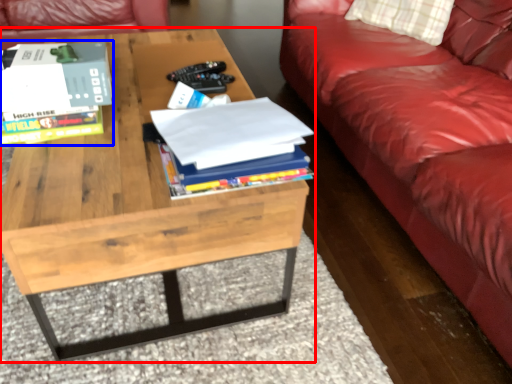
Question: Which point is closer to the camera, coffee table (highlighted by a red box) or book (highlighted by a blue box)?

Choices:
 (A) coffee table
 (B) book

Answer: (A)